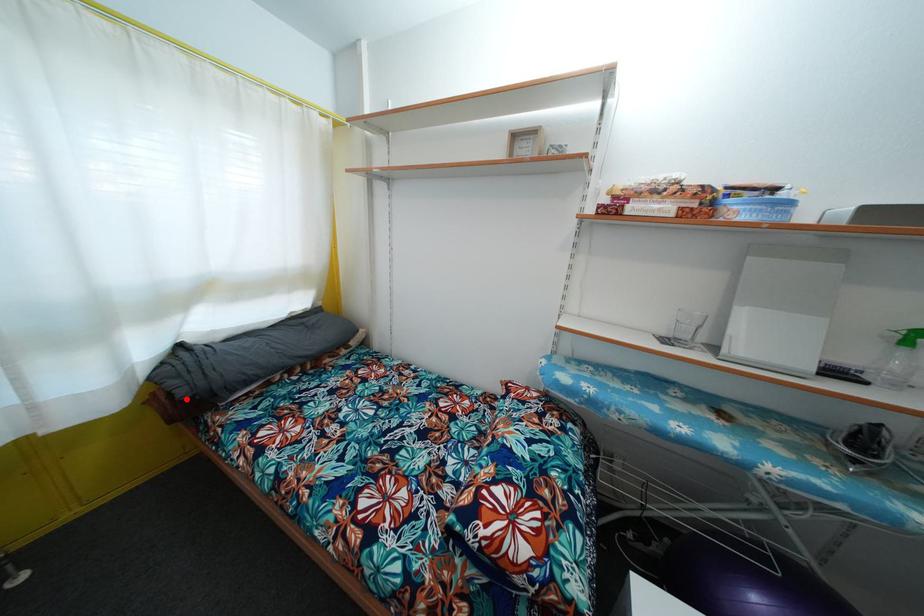
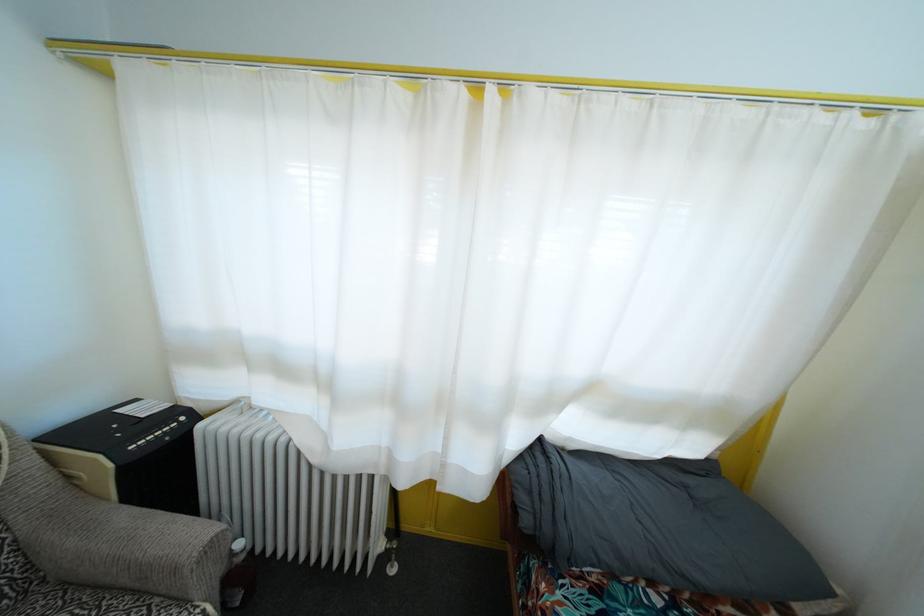
Where in the second image is the point corresponding to the highlighted location from the first image?

(529, 528)